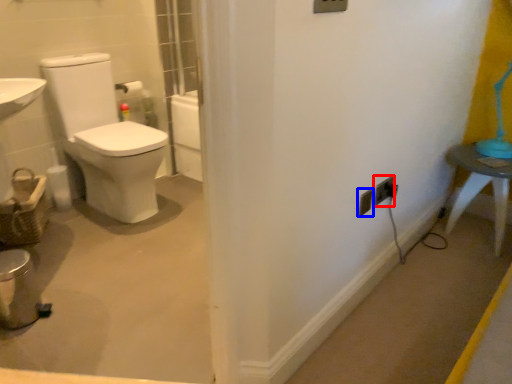
Question: Which point is further to the camera, electric outlet (highlighted by a red box) or electric outlet (highlighted by a blue box)?

Choices:
 (A) electric outlet
 (B) electric outlet

Answer: (A)